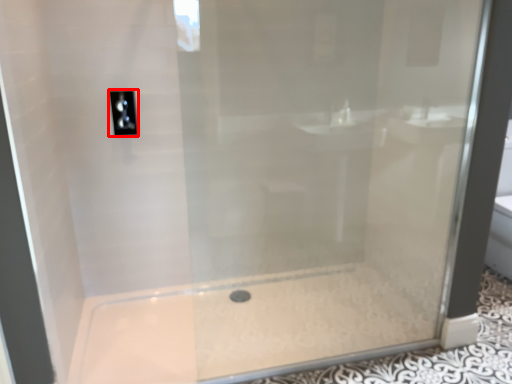
Question: From the image's perspective, considering the relative positions of light switch (annotated by the red box) and bath in the image provided, where is light switch (annotated by the red box) located with respect to the staircase?

Choices:
 (A) below
 (B) above

Answer: (B)